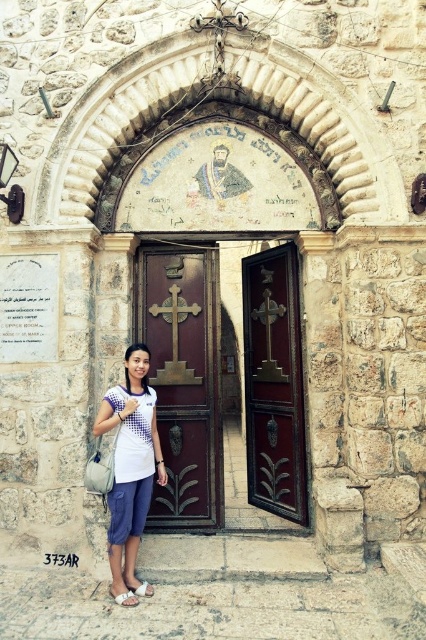
You are a visitor approaching the stone archway and want to enter the church. The entrance has two doors, the dark brown wood door at center and the brown polished wood door at center. Which door should you push to open since one is partially open?

The dark brown wood door at center is larger in size than the brown polished wood door at center, so the partially open door is likely the larger dark brown wood door at center. You should push the dark brown wood door at center to enter.

You are a tour guide leading a group to the entrance of the church. You notice two doors at the center. The first door is the dark brown wood door at center and the second is the dark wood door at center. You want to open both doors simultaneously. Can you fit your hands between them to open them at the same time?

The distance between the dark brown wood door at center and dark wood door at center is 1.57 inches. Since this gap is very narrow, it would be difficult to fit your hands between them to open both doors simultaneously.